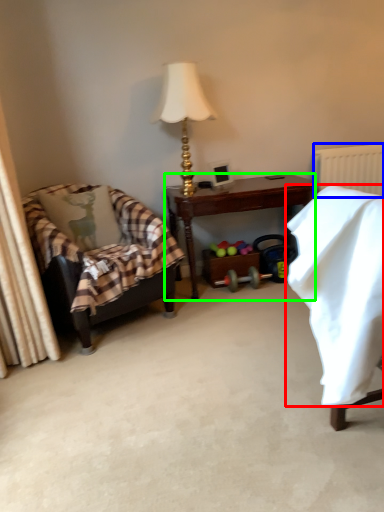
Question: Which is nearer to the blanket (highlighted by a red box)? radiator (highlighted by a blue box) or desk (highlighted by a green box).

Choices:
 (A) radiator
 (B) desk

Answer: (B)